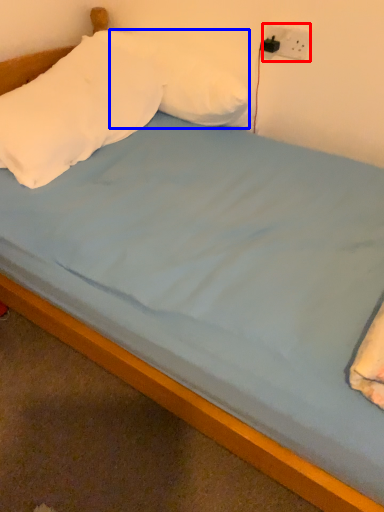
Question: Which object is further to the camera taking this photo, electric outlet (highlighted by a red box) or pillow (highlighted by a blue box)?

Choices:
 (A) electric outlet
 (B) pillow

Answer: (A)